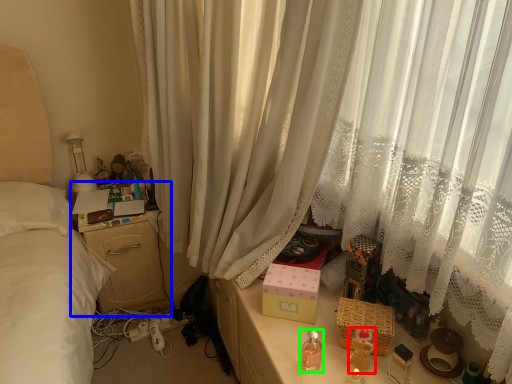
Question: Estimate the real-world distances between objects in this image. Which object is closer to baby bottle (highlighted by a red box), nightstand (highlighted by a blue box) or baby bottle (highlighted by a green box)?

Choices:
 (A) nightstand
 (B) baby bottle

Answer: (B)